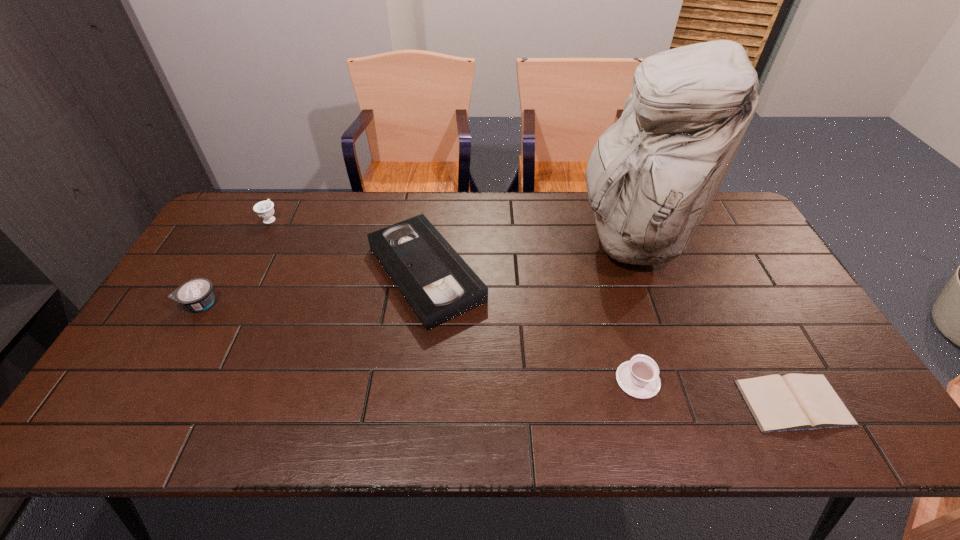
Locate which object is the fifth closest to the Bible. Please provide its 2D coordinates. Your answer should be formatted as a tuple, i.e. [(x, y)], where the tuple contains the x and y coordinates of a point satisfying the conditions above.

[(264, 209)]

Locate an element on the screen. This screenshot has height=540, width=960. vacant area in the image that satisfies the following two spatial constraints: 1. on the front-facing side of the tallest object; 2. on the right side of the shortest object is located at coordinates (687, 402).

Find the location of a particular element. Image resolution: width=960 pixels, height=540 pixels. free space that satisfies the following two spatial constraints: 1. on the front-facing side of the backpack; 2. on the front side of the fourth object from right to left is located at coordinates (641, 273).